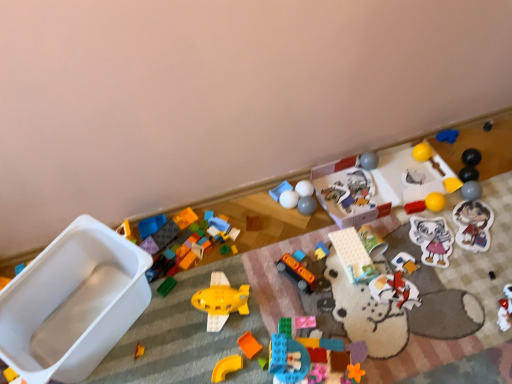
The height and width of the screenshot is (384, 512). Find the location of `free space in front of white glossy sticker at center-right, arranged as the twentieth toy when viewed from the left`. free space in front of white glossy sticker at center-right, arranged as the twentieth toy when viewed from the left is located at coordinates (446, 293).